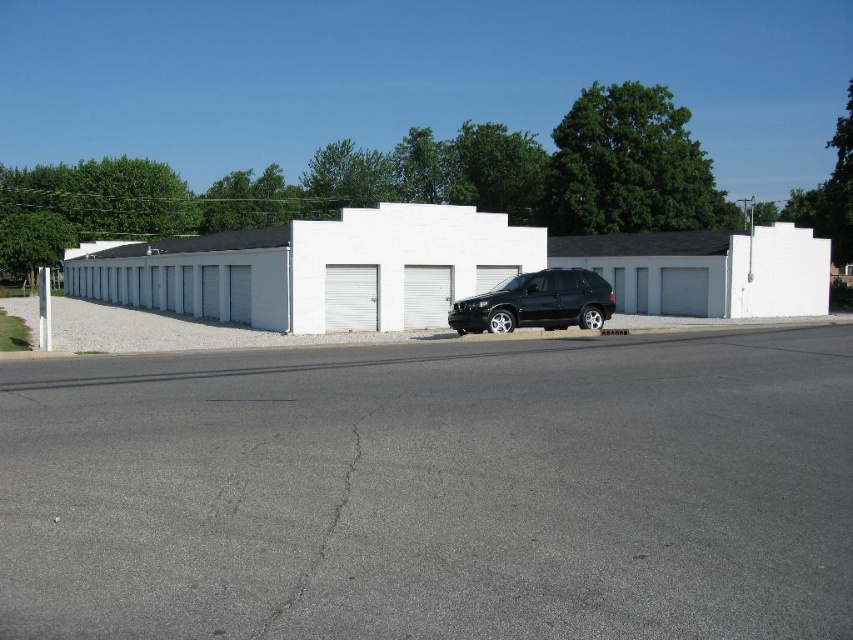
Question: Which of the following is the closest to the observer?

Choices:
 (A) (669, 284)
 (B) (320, 320)
 (C) (409, 282)
 (D) (368, 310)

Answer: (B)

Question: Which of the following is the farthest from the observer?

Choices:
 (A) white rolling door at center
 (B) black matte suv at center

Answer: (A)

Question: Considering the real-world distances, which object is closest to the gray metallic garage door at center?

Choices:
 (A) white metallic garage door at center
 (B) white rolling door at center

Answer: (B)

Question: Does black matte suv at center have a lesser width compared to gray metallic garage door at center?

Choices:
 (A) yes
 (B) no

Answer: (B)

Question: Can you confirm if white matte garage door at center is positioned below white metallic garage door at center?

Choices:
 (A) no
 (B) yes

Answer: (A)

Question: Does black matte suv at center have a smaller size compared to gray metallic garage door at center?

Choices:
 (A) no
 (B) yes

Answer: (A)